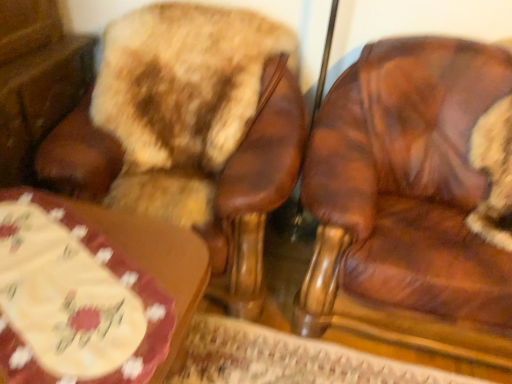
Question: Should I look upward or downward to see brown leather chair at upper left, the second chair viewed from the right?

Choices:
 (A) down
 (B) up

Answer: (B)

Question: From a real-world perspective, is wooden table at lower left positioned under brown leather chair at upper left, placed as the first chair when sorted from left to right, based on gravity?

Choices:
 (A) yes
 (B) no

Answer: (A)

Question: Are wooden table at lower left and brown leather chair at upper left, placed as the first chair when sorted from left to right, far apart?

Choices:
 (A) no
 (B) yes

Answer: (A)

Question: Considering the relative sizes of wooden table at lower left and brown leather chair at upper left, the second chair viewed from the right, in the image provided, is wooden table at lower left taller than brown leather chair at upper left, the second chair viewed from the right,?

Choices:
 (A) yes
 (B) no

Answer: (B)

Question: Considering the relative positions of wooden table at lower left and brown leather chair at upper left, the second chair viewed from the right, in the image provided, is wooden table at lower left to the right of brown leather chair at upper left, the second chair viewed from the right, from the viewer's perspective?

Choices:
 (A) yes
 (B) no

Answer: (B)

Question: Is the position of wooden table at lower left less distant than that of brown leather chair at upper left, placed as the first chair when sorted from left to right?

Choices:
 (A) yes
 (B) no

Answer: (A)

Question: From a real-world perspective, is wooden table at lower left over brown leather chair at upper left, placed as the first chair when sorted from left to right?

Choices:
 (A) yes
 (B) no

Answer: (B)

Question: Is brown leather chair at upper left, the second chair viewed from the right, at the left side of wooden table at lower left?

Choices:
 (A) yes
 (B) no

Answer: (B)

Question: Is brown leather chair at upper left, placed as the first chair when sorted from left to right, aimed at wooden table at lower left?

Choices:
 (A) no
 (B) yes

Answer: (B)

Question: From the image's perspective, is brown leather chair at upper left, the second chair viewed from the right, located beneath wooden table at lower left?

Choices:
 (A) no
 (B) yes

Answer: (A)

Question: Is brown leather chair at upper left, the second chair viewed from the right, wider than wooden table at lower left?

Choices:
 (A) yes
 (B) no

Answer: (A)

Question: Does brown leather chair at upper left, the second chair viewed from the right, have a lesser width compared to wooden table at lower left?

Choices:
 (A) no
 (B) yes

Answer: (A)

Question: From a real-world perspective, does brown leather chair at upper left, placed as the first chair when sorted from left to right, stand above wooden table at lower left?

Choices:
 (A) yes
 (B) no

Answer: (A)

Question: Is wooden table at lower left oriented towards brown leather chair at right, marked as the 2th chair in a left-to-right arrangement?

Choices:
 (A) yes
 (B) no

Answer: (B)